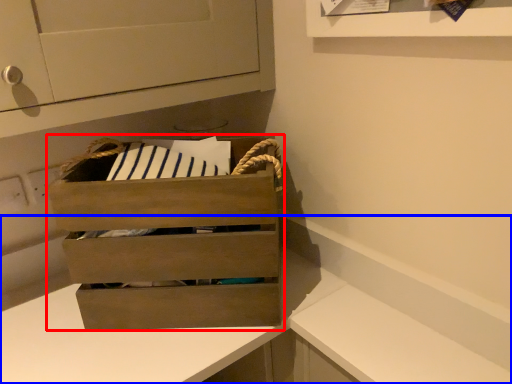
Question: Which of the following is the farthest to the observer, chest of drawers (highlighted by a red box) or counter (highlighted by a blue box)?

Choices:
 (A) chest of drawers
 (B) counter

Answer: (A)